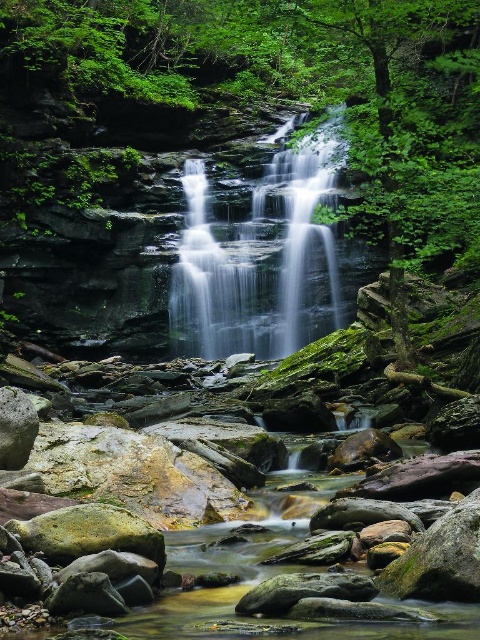
Is point (10, 22) less distant than point (245, 337)?

Yes, point (10, 22) is closer to viewer.

Does point (179, 12) come in front of point (308, 172)?

That is False.

Identify the location of green mossy rocks at center. The width and height of the screenshot is (480, 640). (253, 99).